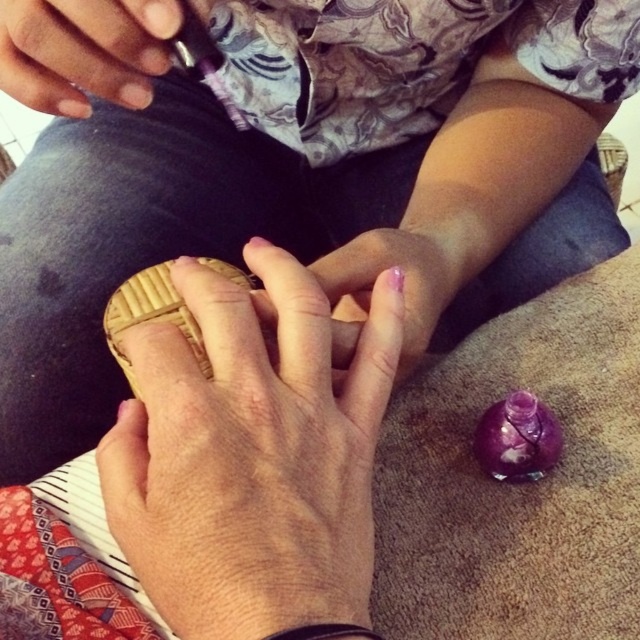
You are an artist observing the scene and need to place a small sticker between the metallic ring at upper left and the pink polished nails at center. Which object should the sticker be closer to if you want it to be placed at the lower position?

The metallic ring at upper left is not as tall as the pink polished nails at center, so placing the sticker closer to the metallic ring at upper left would position it lower since the ring is shorter than the nails.